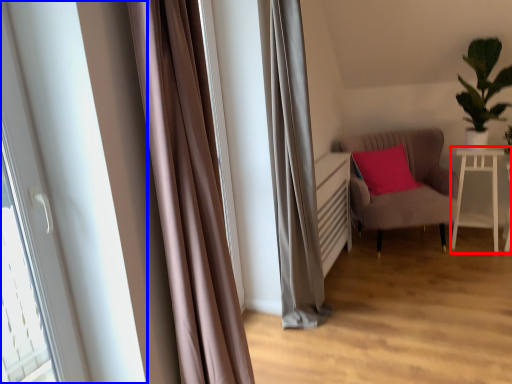
Question: Among these objects, which one is farthest to the camera, table (highlighted by a red box) or bay window (highlighted by a blue box)?

Choices:
 (A) table
 (B) bay window

Answer: (A)